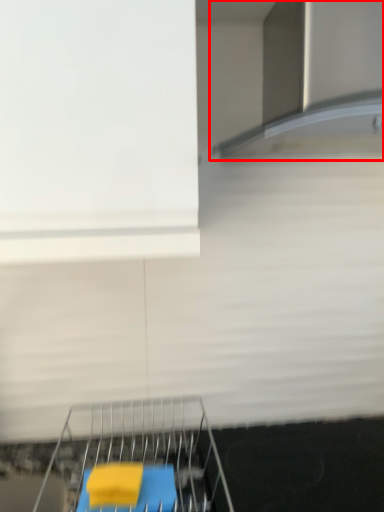
Question: Observing the image, what is the correct spatial positioning of exhaust hood (annotated by the red box) in reference to furniture?

Choices:
 (A) right
 (B) left

Answer: (A)